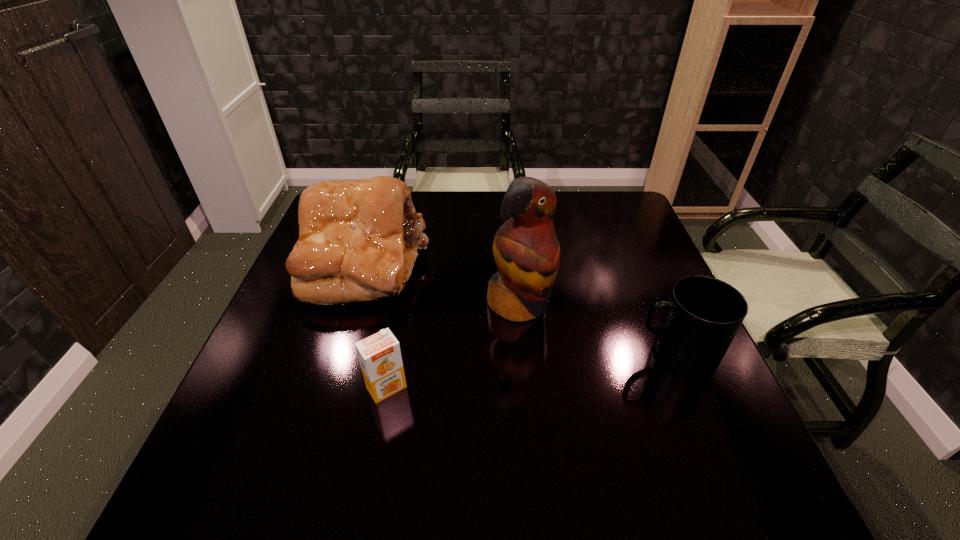
At what (x,y) coordinates should I click in order to perform the action: click on orange juice. Please return your answer as a coordinate pair (x, y). Image resolution: width=960 pixels, height=540 pixels. Looking at the image, I should click on (379, 355).

This screenshot has height=540, width=960. Identify the location of mug. (703, 314).

Image resolution: width=960 pixels, height=540 pixels. Find the location of `the third shortest object`. the third shortest object is located at coordinates (358, 240).

You are a GUI agent. You are given a task and a screenshot of the screen. Output one action in this format:
    pyautogui.click(x=<x>, y=<y>)
    Task: Click on the third object from left to right
    The height and width of the screenshot is (540, 960).
    Given the screenshot: What is the action you would take?
    pyautogui.click(x=526, y=250)

Identify the location of the tallest object. The height and width of the screenshot is (540, 960). (526, 250).

Where is `vacant space located on the left of the orange juice`? Image resolution: width=960 pixels, height=540 pixels. vacant space located on the left of the orange juice is located at coordinates [312, 387].

This screenshot has height=540, width=960. I want to click on vacant space located 0.230m on the side of the rightmost object with the handle, so click(x=529, y=353).

Where is `vacant area situated on the side of the rightmost object with the handle`? The height and width of the screenshot is (540, 960). vacant area situated on the side of the rightmost object with the handle is located at coordinates (501, 353).

Locate an element on the screen. The image size is (960, 540). free space located 0.390m on the side of the rightmost object with the handle is located at coordinates (456, 353).

Where is `blank space located 0.130m on the filling side of the bread`? Image resolution: width=960 pixels, height=540 pixels. blank space located 0.130m on the filling side of the bread is located at coordinates (446, 318).